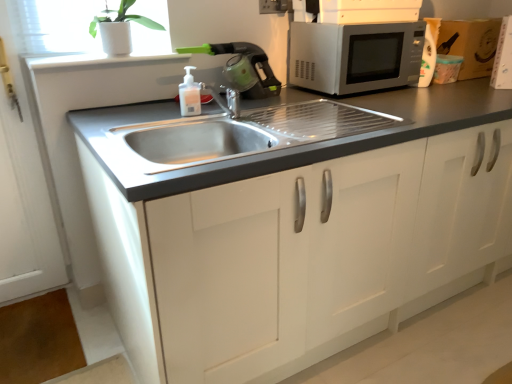
This screenshot has width=512, height=384. I want to click on free space in front of translucent plastic soap dispenser at center, so click(x=176, y=117).